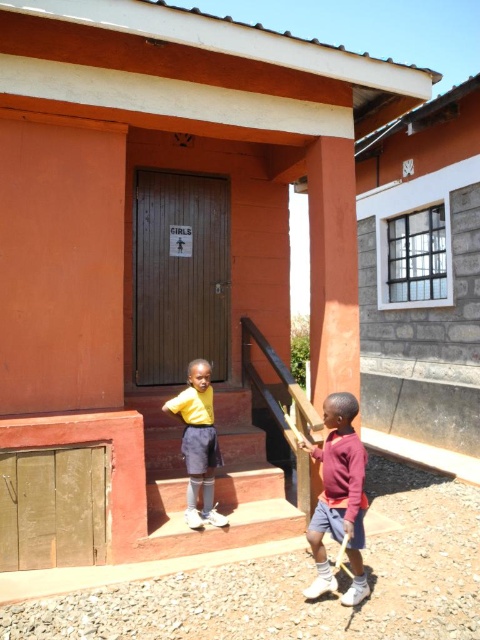
Does orange matte pillar at upper center lie in front of yellow matte shirt at center?

No, orange matte pillar at upper center is behind yellow matte shirt at center.

Is orange matte pillar at upper center smaller than yellow matte shirt at center?

Actually, orange matte pillar at upper center might be larger than yellow matte shirt at center.

The image size is (480, 640). Find the location of `orange matte pillar at upper center`. orange matte pillar at upper center is located at coordinates (333, 268).

Is point (348, 433) closer to camera compared to point (212, 432)?

That is True.

From the picture: Is maroon sweater at lower right thinner than yellow matte shirt at center?

Yes, maroon sweater at lower right is thinner than yellow matte shirt at center.

Which is behind, point (336, 483) or point (206, 499)?

The point (206, 499) is more distant.

You are a GUI agent. You are given a task and a screenshot of the screen. Output one action in this format:
    pyautogui.click(x=<x>, y=<y>)
    Task: Click on the maroon sweater at lower right
    
    Given the screenshot: What is the action you would take?
    pyautogui.click(x=338, y=499)

From the picture: Is brown wooden stairs at center taller than yellow matte shirt at center?

No.

Does brown wooden stairs at center appear on the left side of yellow matte shirt at center?

Incorrect, brown wooden stairs at center is not on the left side of yellow matte shirt at center.

Is point (158, 541) more distant than point (181, 404)?

No, it is in front of (181, 404).

Identify the location of brown wooden stairs at center. This screenshot has width=480, height=640. tap(215, 484).